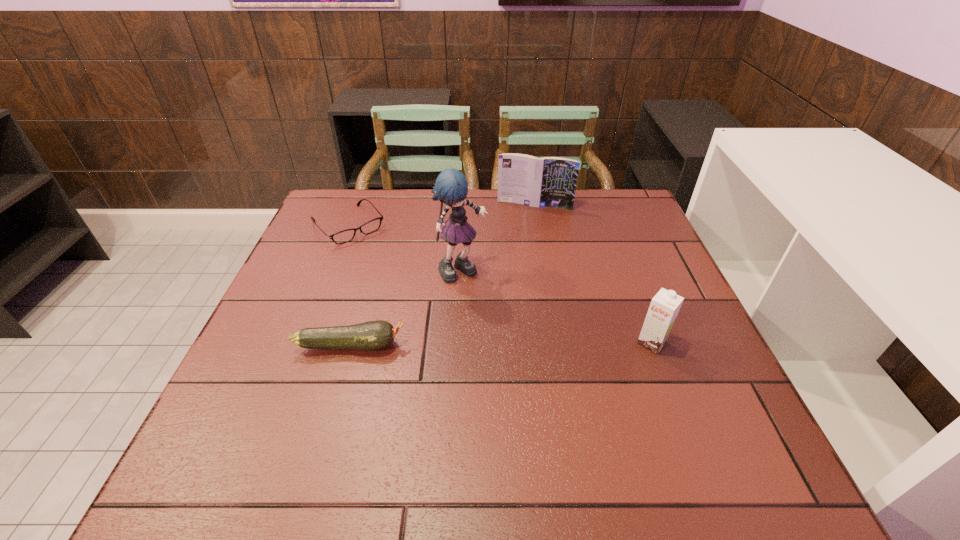
I want to click on the second shortest object, so click(x=373, y=335).

Where is `the rightmost object`? The width and height of the screenshot is (960, 540). the rightmost object is located at coordinates (664, 307).

At what (x,y) coordinates should I click in order to perform the action: click on the shortest object. Please return your answer as a coordinate pair (x, y). Looking at the image, I should click on (373, 225).

Where is `the second object from right to left`? The image size is (960, 540). the second object from right to left is located at coordinates (550, 181).

The height and width of the screenshot is (540, 960). I want to click on rag doll, so click(x=451, y=187).

This screenshot has width=960, height=540. In order to click on the tallest object in this screenshot , I will do `click(451, 187)`.

Where is `vacant space located at the blossom end of the fourth tallest object`? vacant space located at the blossom end of the fourth tallest object is located at coordinates (456, 345).

Identify the location of free spot located 0.220m on the back of the chocolate milk. (623, 268).

Where is `vacant space situated 0.080m on the front-facing side of the shortest object`? This screenshot has height=540, width=960. vacant space situated 0.080m on the front-facing side of the shortest object is located at coordinates (378, 258).

This screenshot has height=540, width=960. I want to click on free space located 0.290m on the front-facing side of the shortest object, so click(419, 301).